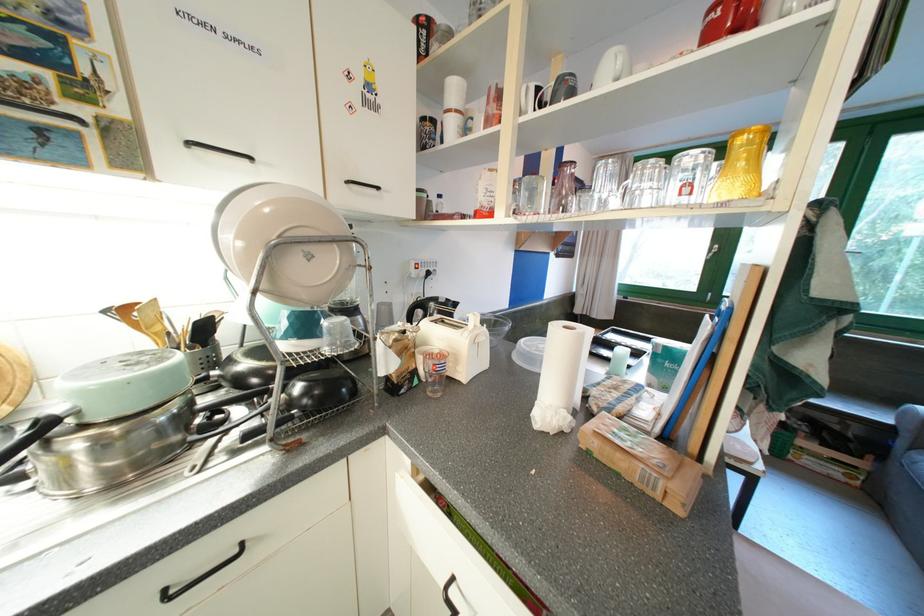
Locate an element on the screen. Image resolution: width=924 pixels, height=616 pixels. black mug handle is located at coordinates (541, 95).